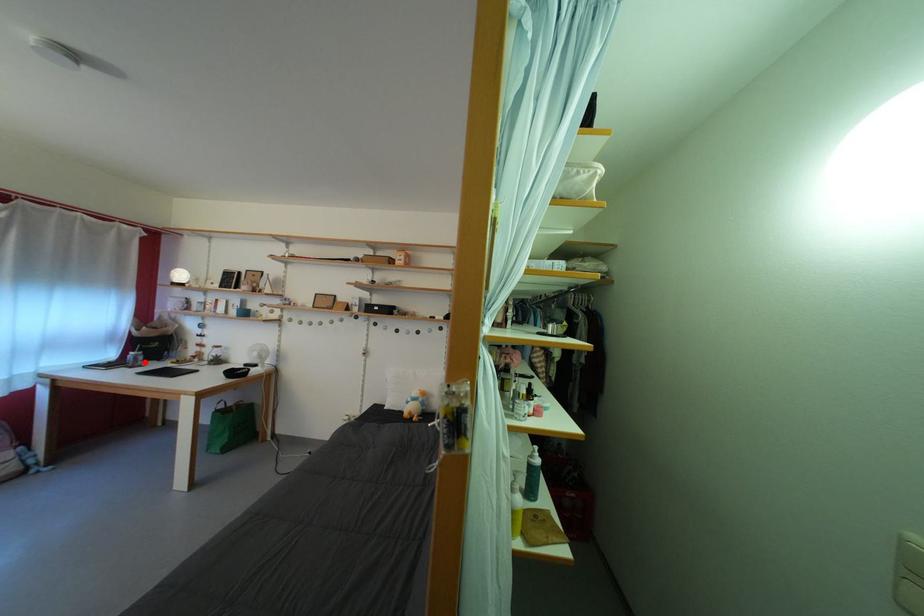
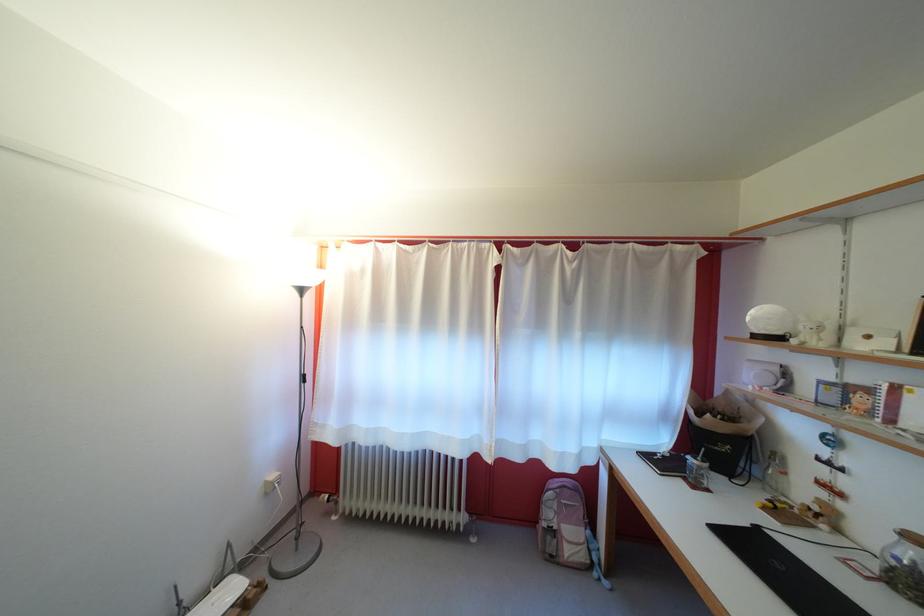
Question: I am providing you with two images of the same scene from different viewpoints. A red point is marked on the first image. Can you still see the location of the red point in image 2?

Choices:
 (A) Yes
 (B) No

Answer: (A)